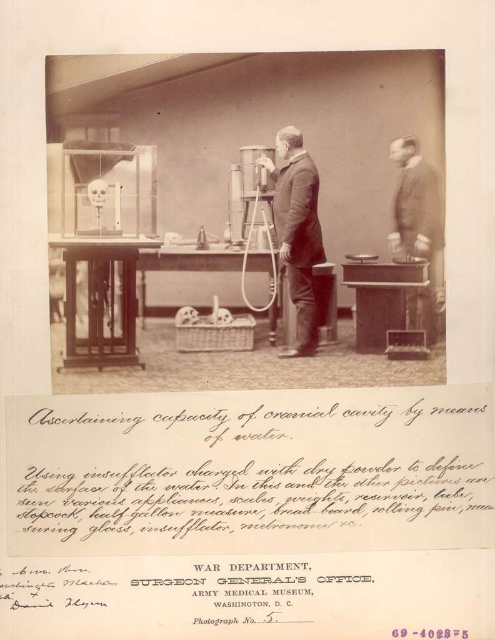
Is matte black suit at right above matte black box at center?

Correct, matte black suit at right is located above matte black box at center.

Is point (435, 221) positioned behind point (366, 285)?

No.

At what (x,y) coordinates should I click in order to perform the action: click on matte black suit at right. Please return your answer as a coordinate pair (x, y). Image resolution: width=495 pixels, height=640 pixels. Looking at the image, I should click on 418,221.

Is smooth suit at center positioned behind matte black box at center?

No, it is not.

In the scene shown: Does smooth suit at center have a greater width compared to matte black box at center?

No.

What do you see at coordinates (297, 230) in the screenshot?
I see `smooth suit at center` at bounding box center [297, 230].

You are a GUI agent. You are given a task and a screenshot of the screen. Output one action in this format:
    pyautogui.click(x=<x>, y=<y>)
    Task: Click on the smooth suit at center
    
    Given the screenshot: What is the action you would take?
    pyautogui.click(x=297, y=230)

Consider the image. Does smooth suit at center have a lesser height compared to matte black suit at right?

No, smooth suit at center is not shorter than matte black suit at right.

You are a GUI agent. You are given a task and a screenshot of the screen. Output one action in this format:
    pyautogui.click(x=<x>, y=<y>)
    Task: Click on the smooth suit at center
    Image resolution: width=495 pixels, height=640 pixels.
    Given the screenshot: What is the action you would take?
    tap(297, 230)